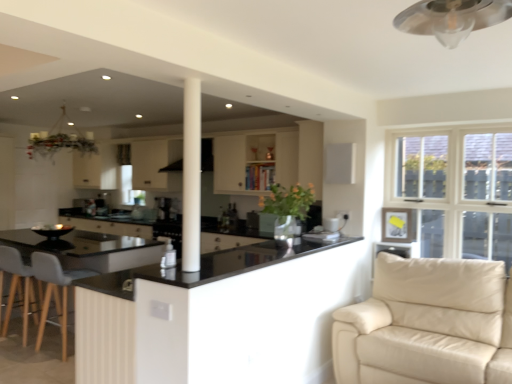
What do you see at coordinates (210, 266) in the screenshot?
I see `black glossy countertop at center, the 1th countertop viewed from the top` at bounding box center [210, 266].

Describe the element at coordinates (452, 18) in the screenshot. This screenshot has height=384, width=512. I see `metallic silver mechanical fan at upper center` at that location.

Measure the distance between point (457, 16) and camera.

A distance of 1.24 meters exists between point (457, 16) and camera.

The width and height of the screenshot is (512, 384). Find the location of `gray fabric swivel chair at lower left`. gray fabric swivel chair at lower left is located at coordinates (20, 288).

Is black glossy countertop at center, which is the second countertop from bottom to top, not close to gray fabric swivel chair at lower left?

Yes, black glossy countertop at center, which is the second countertop from bottom to top, is far from gray fabric swivel chair at lower left.

Where is `swivel chair below the black glossy countertop at center, the 1th countertop viewed from the top (from a real-world perspective)`? swivel chair below the black glossy countertop at center, the 1th countertop viewed from the top (from a real-world perspective) is located at coordinates (20, 288).

Based on their sizes in the image, would you say black glossy countertop at center, which is the second countertop from bottom to top, is bigger or smaller than gray fabric swivel chair at lower left?

Considering their sizes, black glossy countertop at center, which is the second countertop from bottom to top, takes up less space than gray fabric swivel chair at lower left.

Is black glossy countertop at center, the 1th countertop viewed from the top, oriented away from gray fabric swivel chair at lower left?

No.

Which object is positioned more to the left, metallic silver mechanical fan at upper center or black matte exhaust hood at center?

From the viewer's perspective, black matte exhaust hood at center appears more on the left side.

From a real-world perspective, which is physically above, metallic silver mechanical fan at upper center or black matte exhaust hood at center?

metallic silver mechanical fan at upper center is physically above.

Considering the positions of points (480, 1) and (177, 170), is point (480, 1) farther from camera compared to point (177, 170)?

No, (480, 1) is closer to viewer.

Is metallic silver mechanical fan at upper center not near black matte exhaust hood at center?

Yes, metallic silver mechanical fan at upper center is far from black matte exhaust hood at center.

Find the location of a particular element. Image resolution: width=512 pixels, height=384 pixels. exhaust hood that is behind the black glossy countertop at center, which is counted as the second countertop, starting from the top is located at coordinates (207, 154).

Does point (308, 319) lie in front of point (204, 142)?

Yes, point (308, 319) is in front of point (204, 142).

From a real-world perspective, which object stands above the other?

From a 3D spatial view, black matte exhaust hood at center is above.

Is black glossy countertop at center, which is counted as the second countertop, starting from the top, far from black matte exhaust hood at center?

Absolutely, black glossy countertop at center, which is counted as the second countertop, starting from the top, is distant from black matte exhaust hood at center.

Looking at this image, does gray fabric swivel chair at lower left appear on the right side of metallic silver mechanical fan at upper center?

Incorrect, gray fabric swivel chair at lower left is not on the right side of metallic silver mechanical fan at upper center.

Does gray fabric swivel chair at lower left have a larger size compared to metallic silver mechanical fan at upper center?

Yes.

Is gray fabric swivel chair at lower left taller than metallic silver mechanical fan at upper center?

Indeed, gray fabric swivel chair at lower left has a greater height compared to metallic silver mechanical fan at upper center.

From a real-world perspective, who is located lower, gray fabric swivel chair at lower left or metallic silver mechanical fan at upper center?

gray fabric swivel chair at lower left.

From a real-world perspective, is metallic silver mechanical fan at upper center on beige leather couch at lower right?

Yes, from a real-world perspective, metallic silver mechanical fan at upper center is above beige leather couch at lower right.

From the image's perspective, is metallic silver mechanical fan at upper center located above or below beige leather couch at lower right?

metallic silver mechanical fan at upper center is above beige leather couch at lower right.

Between metallic silver mechanical fan at upper center and beige leather couch at lower right, which one has more height?

beige leather couch at lower right is taller.

Is metallic silver mechanical fan at upper center in front of or behind beige leather couch at lower right in the image?

Visually, metallic silver mechanical fan at upper center is located in front of beige leather couch at lower right.

From the image's perspective, does beige leather couch at lower right appear lower than satin black coffee machine at center?

Correct, beige leather couch at lower right appears lower than satin black coffee machine at center in the image.

Considering the sizes of objects beige leather couch at lower right and satin black coffee machine at center in the image provided, who is smaller, beige leather couch at lower right or satin black coffee machine at center?

Smaller between the two is satin black coffee machine at center.

Which object is positioned more to the left, beige leather couch at lower right or satin black coffee machine at center?

From the viewer's perspective, satin black coffee machine at center appears more on the left side.

Based on their sizes in the image, would you say beige leather couch at lower right is bigger or smaller than white smooth column at center?

In the image, beige leather couch at lower right appears to be larger than white smooth column at center.

Considering the relative sizes of beige leather couch at lower right and white smooth column at center in the image provided, is beige leather couch at lower right thinner than white smooth column at center?

In fact, beige leather couch at lower right might be wider than white smooth column at center.

Is beige leather couch at lower right directly adjacent to white smooth column at center?

beige leather couch at lower right and white smooth column at center are not in contact.

This screenshot has height=384, width=512. Find the location of `pillar above the beige leather couch at lower right (from a real-world perspective)`. pillar above the beige leather couch at lower right (from a real-world perspective) is located at coordinates (191, 176).

From a real-world perspective, which countertop is the 2nd one above the gray fabric swivel chair at lower left? Please provide its 2D coordinates.

[(210, 266)]

Where is `exhaust hood directly beneath the metallic silver mechanical fan at upper center (from a real-world perspective)`? The height and width of the screenshot is (384, 512). exhaust hood directly beneath the metallic silver mechanical fan at upper center (from a real-world perspective) is located at coordinates (207, 154).

Looking at the image, which one is located closer to gray fabric swivel chair at lower left, white smooth column at center or beige leather couch at lower right?

white smooth column at center is positioned closer to the anchor gray fabric swivel chair at lower left.

Looking at the image, which one is located further to black glossy countertop at center, which is the 1th countertop from bottom to top, black glossy countertop at center, which is the second countertop from bottom to top, or gray fabric swivel chair at lower left?

The object further to black glossy countertop at center, which is the 1th countertop from bottom to top, is gray fabric swivel chair at lower left.

Which object lies further to the anchor point white fabric curtain at upper center, black matte exhaust hood at center or black glossy countertop at center, which is counted as the second countertop, starting from the top?

black glossy countertop at center, which is counted as the second countertop, starting from the top, is further to white fabric curtain at upper center.

Looking at the image, which one is located further to black glossy countertop at center, which is counted as the second countertop, starting from the top, light gray fabric chair at lower left or beige leather couch at lower right?

light gray fabric chair at lower left is further to black glossy countertop at center, which is counted as the second countertop, starting from the top.

Based on their spatial positions, is metallic silver mechanical fan at upper center or white smooth column at center further from black glossy countertop at center, which is counted as the second countertop, starting from the top?

Among the two, metallic silver mechanical fan at upper center is located further to black glossy countertop at center, which is counted as the second countertop, starting from the top.

Considering their positions, is white smooth column at center positioned closer to metallic silver mechanical fan at upper center than black glossy countertop at center, the 1th countertop viewed from the top?

The object closer to metallic silver mechanical fan at upper center is white smooth column at center.

Looking at this image, considering their positions, is white fabric curtain at upper center positioned closer to light gray fabric chair at lower left than black glossy countertop at center, the 1th countertop viewed from the top?

The object closer to light gray fabric chair at lower left is black glossy countertop at center, the 1th countertop viewed from the top.

Based on their spatial positions, is black glossy countertop at center, which is counted as the second countertop, starting from the top, or white smooth column at center further from gray fabric swivel chair at lower left?

white smooth column at center is further to gray fabric swivel chair at lower left.

This screenshot has width=512, height=384. I want to click on pillar between light gray fabric chair at lower left and black glossy countertop at center, which is the 1th countertop from bottom to top, from left to right, so click(x=191, y=176).

The height and width of the screenshot is (384, 512). In order to click on countertop positioned between white smooth column at center and black matte exhaust hood at center from near to far in this screenshot , I will do `click(217, 318)`.

Find the location of a particular element. The height and width of the screenshot is (384, 512). studio couch positioned between white smooth column at center and satin black coffee machine at center from near to far is located at coordinates (x=426, y=325).

In order to click on studio couch located between metallic silver mechanical fan at upper center and black matte exhaust hood at center in the depth direction in this screenshot , I will do `click(426, 325)`.